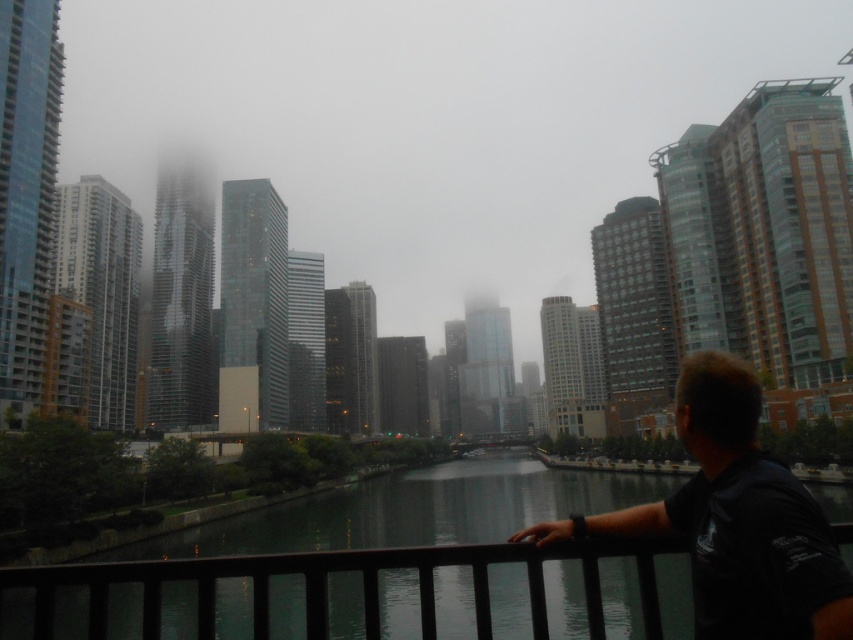
You are standing on a bridge overlooking the city. You notice the dark glass water at center and the black matte shirt at lower right. Which object is positioned lower in the scene?

The dark glass water at center is positioned lower than the black matte shirt at lower right.

You are a photographer standing on the bridge and want to take a photo of the dark glass water at center without the black matte shirt at lower right appearing in the frame. Is this possible given their positions?

The black matte shirt at lower right is behind the dark glass water at center, so you can take the photo of the dark glass water at center without the black matte shirt at lower right appearing in the frame because the dark glass water is in front of the shirt.